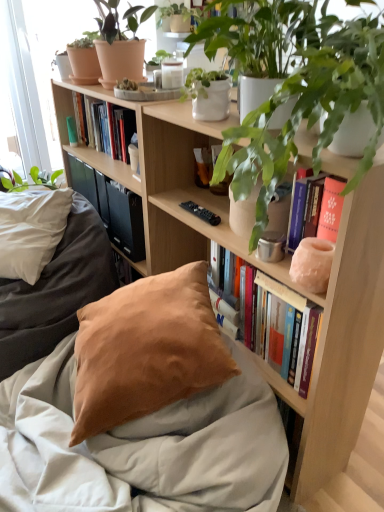
Question: Does hardcover books at upper center, marked as the second book in a front-to-back arrangement, turn towards green matte plant at upper right, which is the 2th houseplant from back to front?

Choices:
 (A) yes
 (B) no

Answer: (B)

Question: Is green matte plant at upper right, which is the first houseplant from bottom to top, a part of hardcover books at upper center, which ranks as the 1th book in top-to-bottom order?

Choices:
 (A) yes
 (B) no

Answer: (B)

Question: From the image's perspective, does hardcover books at upper center, which is the 1th book from left to right, appear lower than green matte plant at upper right, which is the second houseplant from top to bottom?

Choices:
 (A) no
 (B) yes

Answer: (A)

Question: Does hardcover books at upper center, which is the 2th book from bottom to top, come in front of green matte plant at upper right, the 1th houseplant positioned from the right?

Choices:
 (A) no
 (B) yes

Answer: (A)

Question: From a real-world perspective, is hardcover books at upper center, which is the 1th book from left to right, positioned over green matte plant at upper right, which appears as the second houseplant when viewed from the left, based on gravity?

Choices:
 (A) yes
 (B) no

Answer: (B)

Question: From a real-world perspective, is terracotta clay pot at upper left physically located above or below wooden bookcase at center?

Choices:
 (A) below
 (B) above

Answer: (B)

Question: In terms of height, does terracotta clay pot at upper left look taller or shorter compared to wooden bookcase at center?

Choices:
 (A) tall
 (B) short

Answer: (B)

Question: Considering the relative positions of terracotta clay pot at upper left and wooden bookcase at center in the image provided, is terracotta clay pot at upper left to the left or to the right of wooden bookcase at center?

Choices:
 (A) left
 (B) right

Answer: (A)

Question: Does point (84, 67) appear closer or farther from the camera than point (370, 244)?

Choices:
 (A) closer
 (B) farther

Answer: (B)

Question: From a real-world perspective, is matte terracotta pot at upper left, positioned as the 1th houseplant in left-to-right order, physically located above or below satin beige pillow at lower center?

Choices:
 (A) above
 (B) below

Answer: (A)

Question: Considering the positions of point (104, 69) and point (236, 355), is point (104, 69) closer or farther from the camera than point (236, 355)?

Choices:
 (A) closer
 (B) farther

Answer: (B)

Question: Would you say matte terracotta pot at upper left, the second houseplant from the right, is to the left or to the right of satin beige pillow at lower center in the picture?

Choices:
 (A) right
 (B) left

Answer: (B)

Question: Relative to satin beige pillow at lower center, is matte terracotta pot at upper left, the 2th houseplant positioned from the front, in front or behind?

Choices:
 (A) behind
 (B) front

Answer: (A)

Question: From the image's perspective, relative to satin beige pillow at lower center, is matte pink stone vase at upper right, positioned as the first book in right-to-left order, above or below?

Choices:
 (A) above
 (B) below

Answer: (A)

Question: Is matte pink stone vase at upper right, marked as the second book in a top-to-bottom arrangement, in front of or behind satin beige pillow at lower center in the image?

Choices:
 (A) behind
 (B) front

Answer: (A)